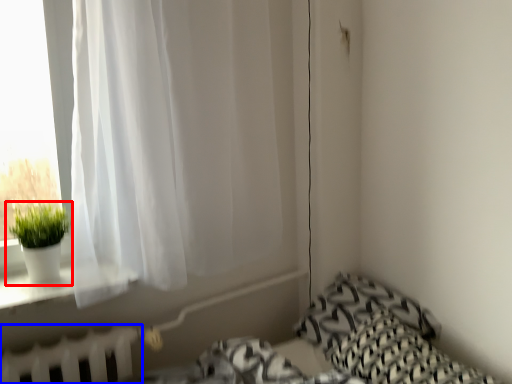
Question: Which point is closer to the camera, houseplant (highlighted by a red box) or radiator (highlighted by a blue box)?

Choices:
 (A) houseplant
 (B) radiator

Answer: (B)